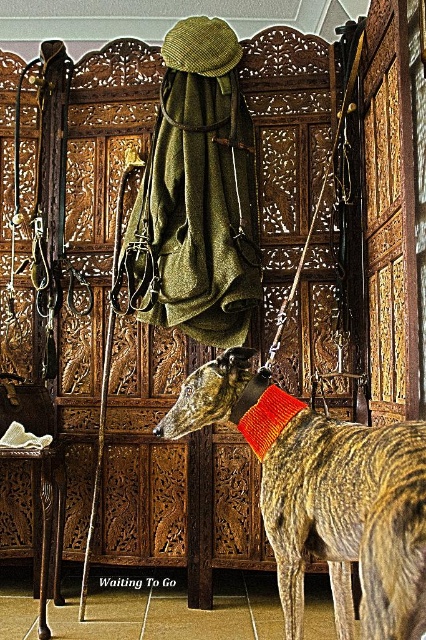
Question: Does striped fur dog at center come in front of orange knitted neckband at center?

Choices:
 (A) no
 (B) yes

Answer: (B)

Question: Does striped fur dog at center appear over orange knitted neckband at center?

Choices:
 (A) yes
 (B) no

Answer: (B)

Question: Among these objects, which one is nearest to the camera?

Choices:
 (A) striped fur dog at center
 (B) orange knitted neckband at center

Answer: (A)

Question: Does striped fur dog at center appear on the left side of orange knitted neckband at center?

Choices:
 (A) no
 (B) yes

Answer: (A)